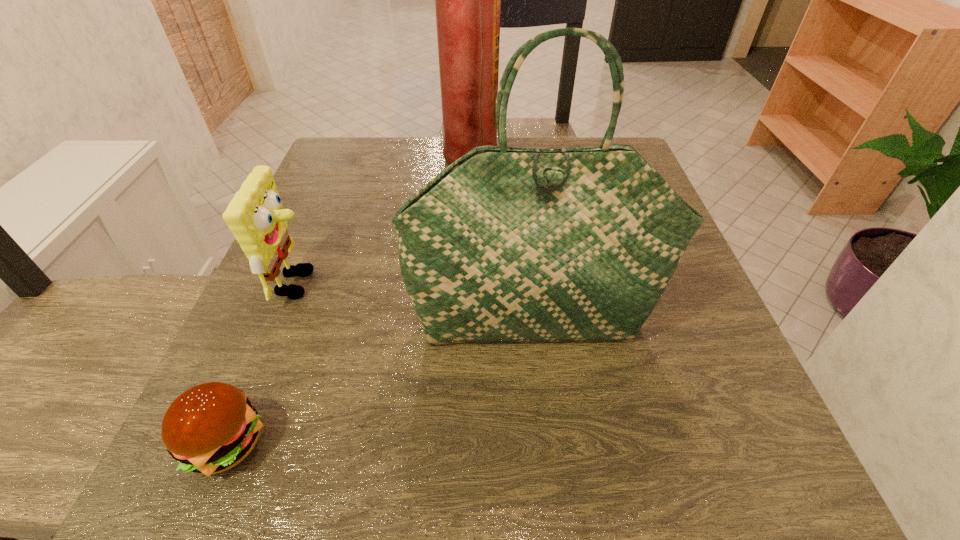
The height and width of the screenshot is (540, 960). Identify the location of object that is at the near edge. (210, 428).

Locate an element on the screen. Image resolution: width=960 pixels, height=540 pixels. sponge located at the left edge is located at coordinates (255, 215).

This screenshot has width=960, height=540. In order to click on hamburger positioned at the left edge in this screenshot , I will do `click(210, 428)`.

The height and width of the screenshot is (540, 960). What are the coordinates of `object that is at the right edge` in the screenshot? It's located at (506, 245).

The width and height of the screenshot is (960, 540). What are the coordinates of `object that is at the near left corner` in the screenshot? It's located at (210, 428).

Find the location of a particular element. vacant space at the far edge of the desktop is located at coordinates (442, 172).

Identify the location of blank space at the near edge of the desktop. (324, 446).

In the image, there is a desktop. At what (x,y) coordinates should I click in order to perform the action: click on free space at the left edge. Please return your answer as a coordinate pair (x, y). The image size is (960, 540). Looking at the image, I should click on (313, 331).

Locate an element on the screen. The width and height of the screenshot is (960, 540). free space at the far left corner of the desktop is located at coordinates (328, 181).

Identify the location of empty space between the sponge and the shortest object. This screenshot has width=960, height=540. point(263,363).